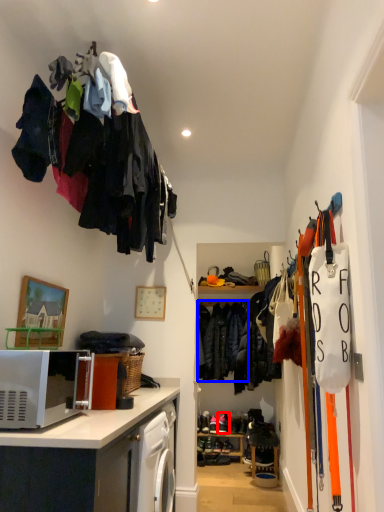
Question: Which point is closer to the camera, footwear (highlighted by a red box) or clothing (highlighted by a blue box)?

Choices:
 (A) footwear
 (B) clothing

Answer: (B)